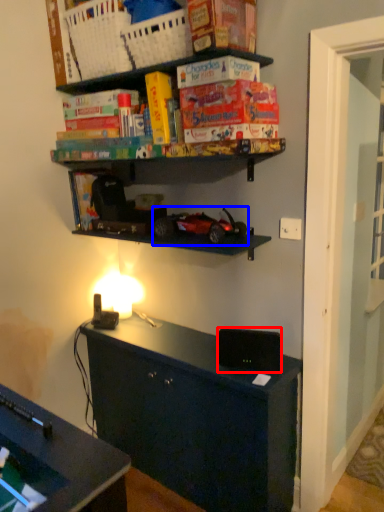
Question: Among these objects, which one is nearest to the camera, speaker (highlighted by a red box) or model car (highlighted by a blue box)?

Choices:
 (A) speaker
 (B) model car

Answer: (B)